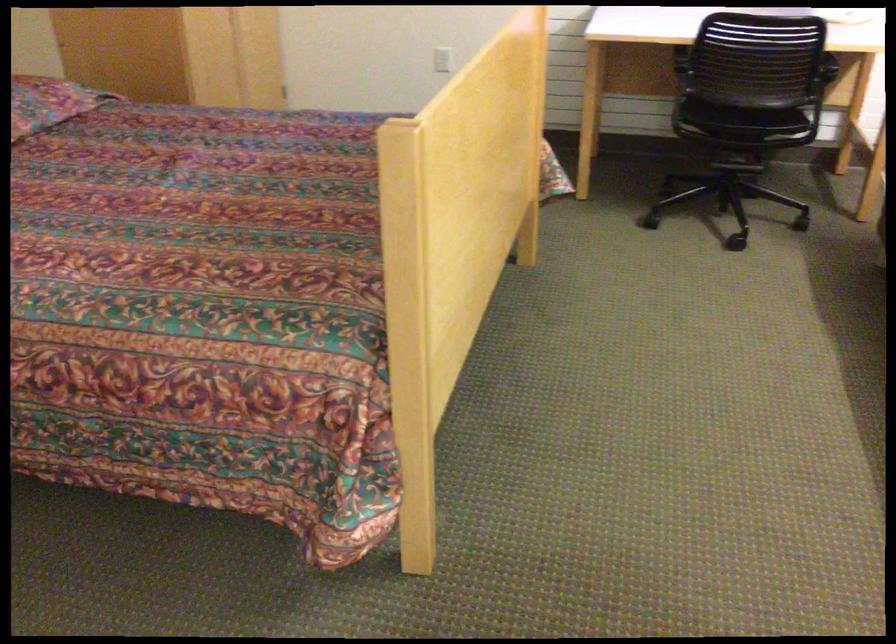
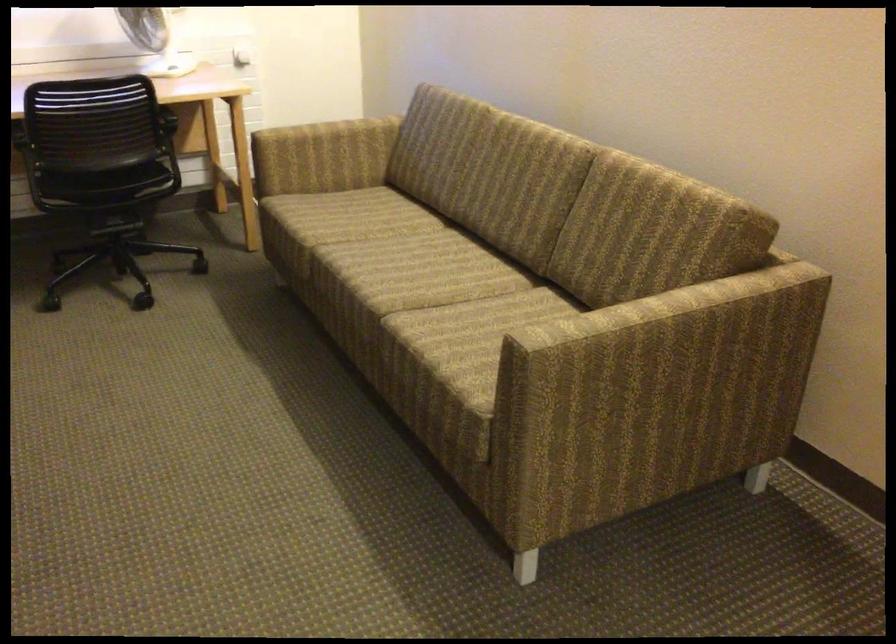
Question: The camera is either moving clockwise (left) or counter-clockwise (right) around the object. The first image is from the beginning of the video and the second image is from the end. Is the camera moving left or right when shooting the video?

Choices:
 (A) Left
 (B) Right

Answer: (A)